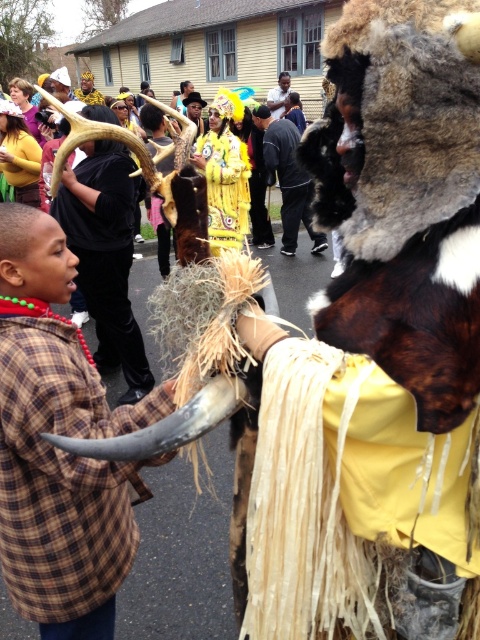
You are standing in the middle of the crowd watching the event. There are two points marked in the image, one at point coordinates point [302,172] and another at point coordinates point [3,145]. Which point is closer to you?

Point [3,145] is closer to you because it is closer to the camera than point [302,172].

You are at the event and want to take a photo of the yellow feather headdress at upper center without including the black leather jacket at center in the frame. Which direction should you move to achieve this?

Move to the right side of the yellow feather headdress at upper center to avoid including the black leather jacket at center, which is positioned to its right.